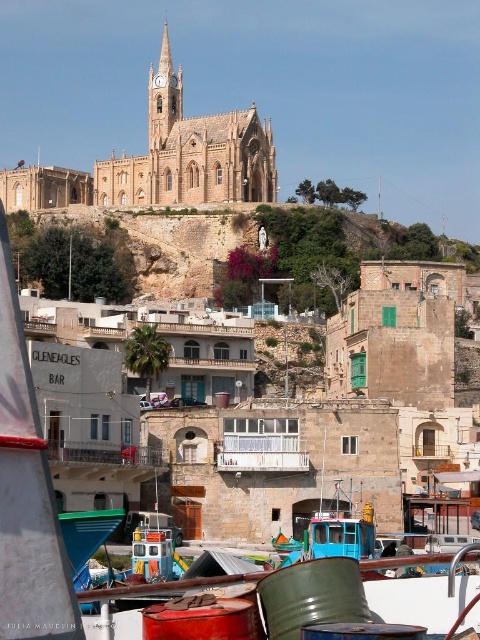
Question: Is beige stone church at upper center positioned behind brown stone hillside at center?

Choices:
 (A) yes
 (B) no

Answer: (A)

Question: Which of the following is the farthest from the observer?

Choices:
 (A) brown stone hillside at center
 (B) beige stone church at upper center

Answer: (B)

Question: Does beige stone church at upper center lie behind brown stone hillside at center?

Choices:
 (A) yes
 (B) no

Answer: (A)

Question: Which of the following is the closest to the observer?

Choices:
 (A) (177, 212)
 (B) (192, 193)

Answer: (A)

Question: Which of the following is the closest to the observer?

Choices:
 (A) (181, 280)
 (B) (184, 176)

Answer: (A)

Question: Does beige stone church at upper center come in front of brown stone hillside at center?

Choices:
 (A) yes
 (B) no

Answer: (B)